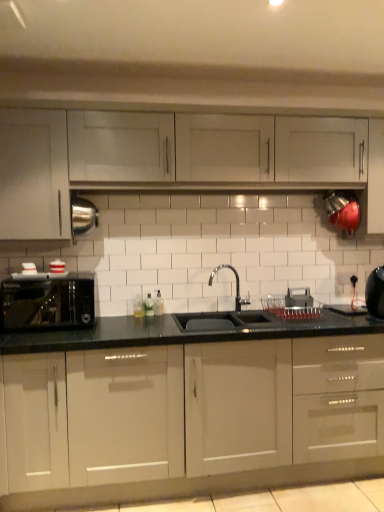
Describe the element at coordinates (158, 304) in the screenshot. This screenshot has width=384, height=512. I see `translucent plastic bottle at center` at that location.

Measure the distance between point (x=16, y=172) and camera.

A distance of 7.66 feet exists between point (x=16, y=172) and camera.

This screenshot has width=384, height=512. Find the location of `white glossy cabinets at upper center, the 3th cabinetry in the bottom-to-top sequence`. white glossy cabinets at upper center, the 3th cabinetry in the bottom-to-top sequence is located at coordinates (220, 149).

Can you tell me how much white glossy cabinet at upper left, the 2th cabinetry from the top, and white plastic electric outlet at center differ in facing direction?

The facing directions of white glossy cabinet at upper left, the 2th cabinetry from the top, and white plastic electric outlet at center are 0.627 degrees apart.

Is white glossy cabinet at upper left, the 2th cabinetry from the top, in front of or behind white plastic electric outlet at center in the image?

In the image, white glossy cabinet at upper left, the 2th cabinetry from the top, appears in front of white plastic electric outlet at center.

Is white glossy cabinet at upper left, which appears as the second cabinetry when ordered from the bottom, with white plastic electric outlet at center?

There is a gap between white glossy cabinet at upper left, which appears as the second cabinetry when ordered from the bottom, and white plastic electric outlet at center.

From the image's perspective, which is above, white glossy cabinet at upper left, the 2th cabinetry from the top, or white plastic electric outlet at center?

white glossy cabinet at upper left, the 2th cabinetry from the top.

From the image's perspective, relative to translucent plastic bottle at center, is white glossy cabinet at upper left, the 2th cabinetry from the top, above or below?

From the image's perspective, white glossy cabinet at upper left, the 2th cabinetry from the top, appears above translucent plastic bottle at center.

Considering the sizes of white glossy cabinet at upper left, the 2th cabinetry from the top, and translucent plastic bottle at center in the image, is white glossy cabinet at upper left, the 2th cabinetry from the top, taller or shorter than translucent plastic bottle at center?

white glossy cabinet at upper left, the 2th cabinetry from the top, is taller than translucent plastic bottle at center.

Is white glossy cabinet at upper left, the 2th cabinetry from the top, facing towards translucent plastic bottle at center?

No, white glossy cabinet at upper left, the 2th cabinetry from the top, does not turn towards translucent plastic bottle at center.

Would you consider white plastic electric outlet at center to be distant from white glossy cabinets at upper center, placed as the first cabinetry when sorted from top to bottom?

white plastic electric outlet at center is positioned a significant distance from white glossy cabinets at upper center, placed as the first cabinetry when sorted from top to bottom.

From the image's perspective, is white plastic electric outlet at center positioned above or below white glossy cabinets at upper center, the 3th cabinetry in the bottom-to-top sequence?

white plastic electric outlet at center is situated lower than white glossy cabinets at upper center, the 3th cabinetry in the bottom-to-top sequence, in the image.

Can you confirm if white plastic electric outlet at center is wider than white glossy cabinets at upper center, placed as the first cabinetry when sorted from top to bottom?

No.

From the picture: Is white glossy cabinets at upper center, placed as the first cabinetry when sorted from top to bottom, at the back of white plastic electric outlet at center?

That's not correct — white plastic electric outlet at center is not looking away from white glossy cabinets at upper center, placed as the first cabinetry when sorted from top to bottom.

From their relative heights in the image, would you say translucent plastic bottle at center is taller or shorter than satin black toaster at left?

In the image, translucent plastic bottle at center appears to be shorter than satin black toaster at left.

From a real-world perspective, is translucent plastic bottle at center under satin black toaster at left?

Indeed, from a real-world perspective, translucent plastic bottle at center is positioned beneath satin black toaster at left.

Is translucent plastic bottle at center completely or partially outside of satin black toaster at left?

Yes.

Can you tell me how much satin black toaster at left and white glossy cabinets at upper center, the 3th cabinetry in the bottom-to-top sequence, differ in facing direction?

Answer: satin black toaster at left and white glossy cabinets at upper center, the 3th cabinetry in the bottom-to-top sequence, are facing 0.991 degrees away from each other.

Does satin black toaster at left have a greater width compared to white glossy cabinets at upper center, the 3th cabinetry in the bottom-to-top sequence?

Yes, satin black toaster at left is wider than white glossy cabinets at upper center, the 3th cabinetry in the bottom-to-top sequence.

Is white glossy cabinets at upper center, placed as the first cabinetry when sorted from top to bottom, surrounded by satin black toaster at left?

Definitely not — white glossy cabinets at upper center, placed as the first cabinetry when sorted from top to bottom, is not inside satin black toaster at left.

The width and height of the screenshot is (384, 512). I want to click on home appliance lying below the white glossy cabinets at upper center, the 3th cabinetry in the bottom-to-top sequence (from the image's perspective), so click(x=47, y=301).

In terms of height, does black glossy kettle at right look taller or shorter compared to white glossy cabinet at upper left, which appears as the second cabinetry when ordered from the bottom?

Considering their sizes, black glossy kettle at right has less height than white glossy cabinet at upper left, which appears as the second cabinetry when ordered from the bottom.

In order to click on appliance lying below the white glossy cabinet at upper left, the 2th cabinetry from the top (from the image's perspective) in this screenshot , I will do `click(375, 292)`.

In the scene shown: From a real-world perspective, which is physically above, black glossy kettle at right or white glossy cabinet at upper left, which appears as the second cabinetry when ordered from the bottom?

white glossy cabinet at upper left, which appears as the second cabinetry when ordered from the bottom, from a real-world perspective.

Considering the sizes of objects black glossy kettle at right and white glossy cabinet at upper left, which appears as the second cabinetry when ordered from the bottom, in the image provided, who is thinner, black glossy kettle at right or white glossy cabinet at upper left, which appears as the second cabinetry when ordered from the bottom,?

black glossy kettle at right.

Can you confirm if black glossy kettle at right is bigger than white glossy cabinets at upper center, the 3th cabinetry in the bottom-to-top sequence?

Incorrect, black glossy kettle at right is not larger than white glossy cabinets at upper center, the 3th cabinetry in the bottom-to-top sequence.

Is black glossy kettle at right oriented away from white glossy cabinets at upper center, placed as the first cabinetry when sorted from top to bottom?

black glossy kettle at right is not turned away from white glossy cabinets at upper center, placed as the first cabinetry when sorted from top to bottom.

Which is behind, point (372, 310) or point (183, 156)?

The point (372, 310) is farther.

I want to click on appliance lying behind the white glossy cabinets at upper center, placed as the first cabinetry when sorted from top to bottom, so click(375, 292).

The image size is (384, 512). I want to click on electric outlet located underneath the white glossy cabinet at upper left, the 2th cabinetry from the top (from a real-world perspective), so click(x=343, y=278).

From a real-world perspective, starting from the translucent plastic bottle at center, which cabinetry is the 1st one vertically above it? Please provide its 2D coordinates.

[(34, 176)]

When comparing their distances from translucent plastic bottle at center, does white glossy cabinets at upper center, placed as the first cabinetry when sorted from top to bottom, or black glossy kettle at right seem further?

black glossy kettle at right is further to translucent plastic bottle at center.

Looking at the image, which one is located closer to translucent plastic bottle at center, black glossy kettle at right or satin black toaster at left?

satin black toaster at left is positioned closer to the anchor translucent plastic bottle at center.

Estimate the real-world distances between objects in this image. Which object is further from translucent plastic bottle at center, satin black toaster at left or white plastic electric outlet at center?

Among the two, white plastic electric outlet at center is located further to translucent plastic bottle at center.

Based on their spatial positions, is translucent plastic bottle at center or satin black toaster at left closer to white plastic electric outlet at center?

translucent plastic bottle at center lies closer to white plastic electric outlet at center than the other object.

Which object lies nearer to the anchor point translucent plastic bottle at center, glossy white cabinets at center, the first cabinetry in the bottom-to-top sequence, or white glossy cabinets at upper center, the 3th cabinetry in the bottom-to-top sequence?

glossy white cabinets at center, the first cabinetry in the bottom-to-top sequence, is positioned closer to the anchor translucent plastic bottle at center.

Looking at the image, which one is located further to glossy white cabinets at center, the first cabinetry in the bottom-to-top sequence, white glossy cabinet at upper left, the 2th cabinetry from the top, or black glossy kettle at right?

Among the two, white glossy cabinet at upper left, the 2th cabinetry from the top, is located further to glossy white cabinets at center, the first cabinetry in the bottom-to-top sequence.

Based on their spatial positions, is white plastic electric outlet at center or white glossy cabinet at upper left, the 2th cabinetry from the top, further from glossy white cabinets at center, the 3th cabinetry from the top?

white plastic electric outlet at center is further to glossy white cabinets at center, the 3th cabinetry from the top.

Looking at this image, estimate the real-world distances between objects in this image. Which object is further from black glossy kettle at right, white plastic electric outlet at center or translucent plastic bottle at center?

The object further to black glossy kettle at right is translucent plastic bottle at center.

Where is `bottle between white glossy cabinet at upper left, the 2th cabinetry from the top, and black glossy kettle at right`? bottle between white glossy cabinet at upper left, the 2th cabinetry from the top, and black glossy kettle at right is located at coordinates (158, 304).

Locate an element on the screen. electric outlet between white glossy cabinets at upper center, the 3th cabinetry in the bottom-to-top sequence, and glossy white cabinets at center, the 3th cabinetry from the top, in the vertical direction is located at coordinates (343, 278).

At what (x,y) coordinates should I click in order to perform the action: click on home appliance that lies between white glossy cabinet at upper left, which appears as the second cabinetry when ordered from the bottom, and glossy white cabinets at center, the first cabinetry in the bottom-to-top sequence, from top to bottom. Please return your answer as a coordinate pair (x, y). Image resolution: width=384 pixels, height=512 pixels. Looking at the image, I should click on (47, 301).

Image resolution: width=384 pixels, height=512 pixels. Identify the location of home appliance between white glossy cabinets at upper center, placed as the first cabinetry when sorted from top to bottom, and glossy white cabinets at center, the 3th cabinetry from the top, from top to bottom. (47, 301).